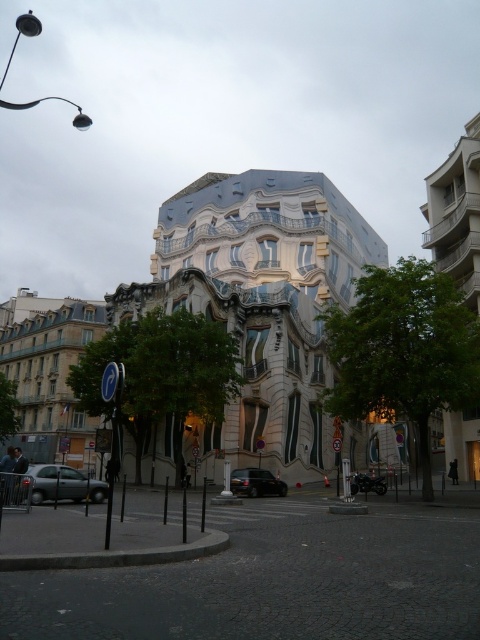
Question: From the image, what is the correct spatial relationship of silver metallic car at lower left in relation to shiny black car at center?

Choices:
 (A) left
 (B) right

Answer: (A)

Question: Is silver metallic car at lower left thinner than shiny black car at center?

Choices:
 (A) yes
 (B) no

Answer: (B)

Question: Observing the image, what is the correct spatial positioning of silver metallic car at lower left in reference to shiny black car at center?

Choices:
 (A) right
 (B) left

Answer: (B)

Question: Which point is farther to the camera?

Choices:
 (A) shiny black car at center
 (B) silver metallic car at lower left

Answer: (A)